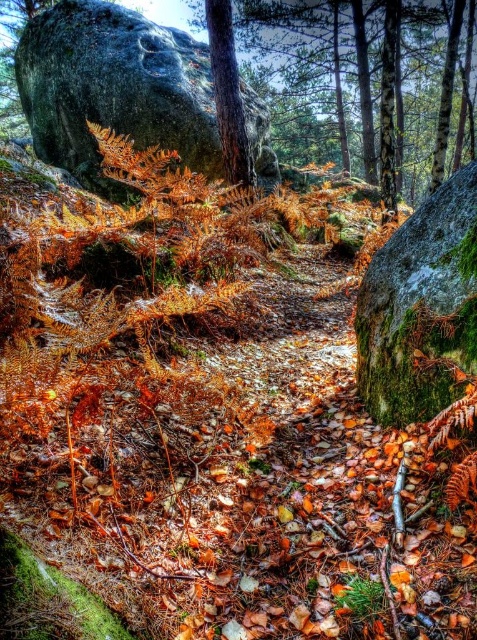
Question: Can you confirm if green mossy rock at upper left is thinner than green mossy boulder at right?

Choices:
 (A) no
 (B) yes

Answer: (A)

Question: Which point is closer to the camera?

Choices:
 (A) green mossy rock at upper left
 (B) green mossy boulder at right

Answer: (B)

Question: Can you confirm if green mossy rock at upper left is positioned to the right of green mossy boulder at right?

Choices:
 (A) yes
 (B) no

Answer: (B)

Question: Which point is farther to the camera?

Choices:
 (A) (113, 35)
 (B) (457, 276)

Answer: (A)

Question: Which point is farther to the camera?

Choices:
 (A) (435, 196)
 (B) (215, 116)

Answer: (B)

Question: Can you confirm if green mossy rock at upper left is positioned above green mossy boulder at right?

Choices:
 (A) yes
 (B) no

Answer: (A)